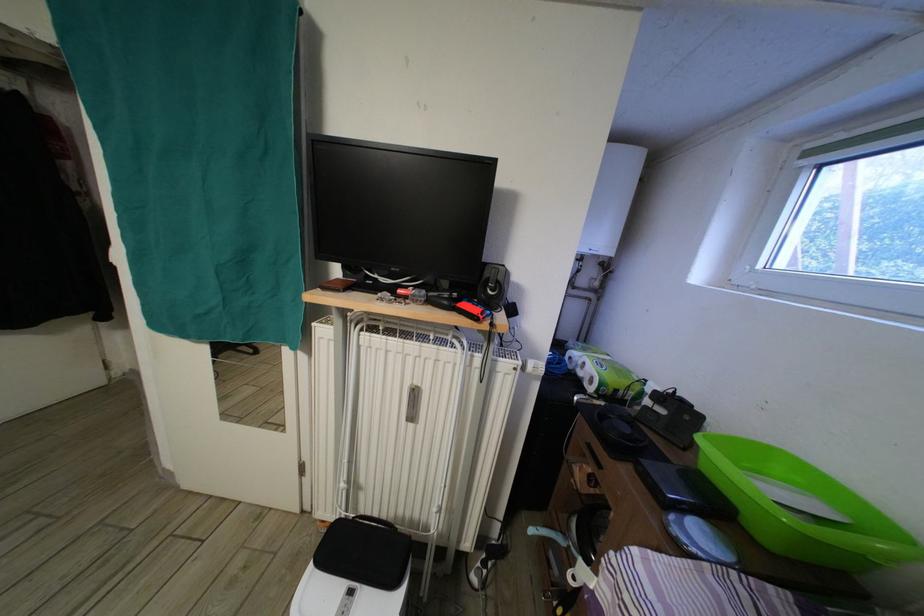
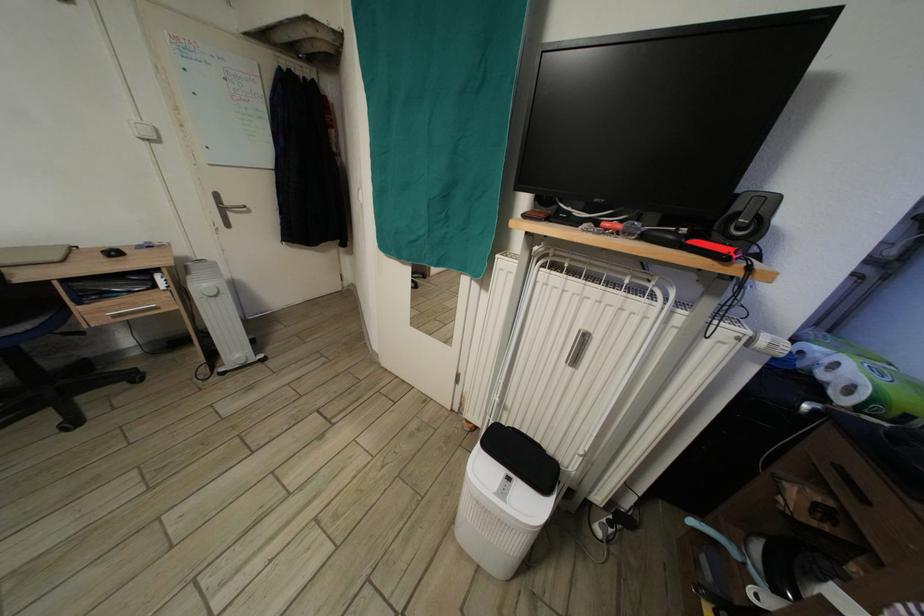
Question: What movement of the cameraman would produce the second image?

Choices:
 (A) Left
 (B) Right
 (C) Forward
 (D) Backward

Answer: (A)